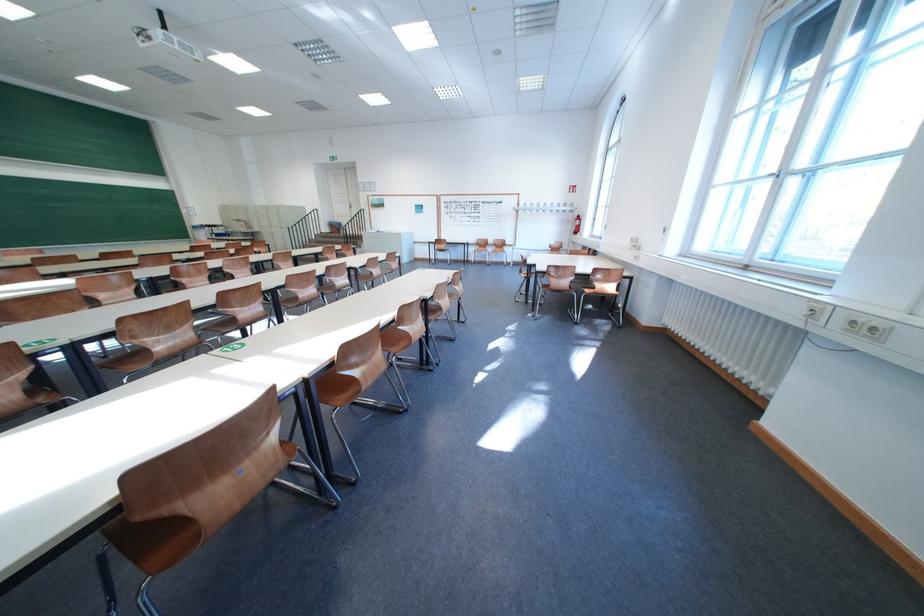
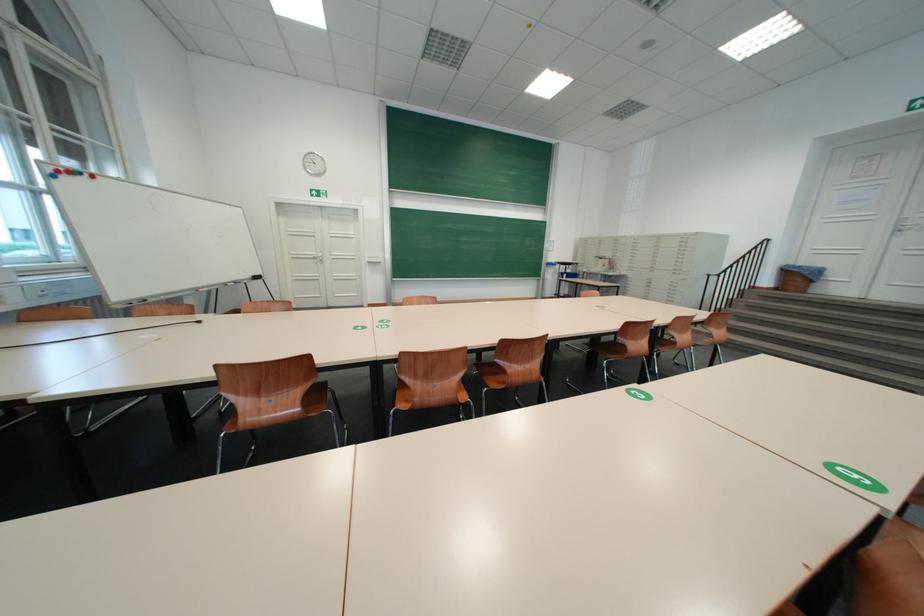
Find the pixel in the second image that matches point (339, 232) in the first image.

(781, 283)